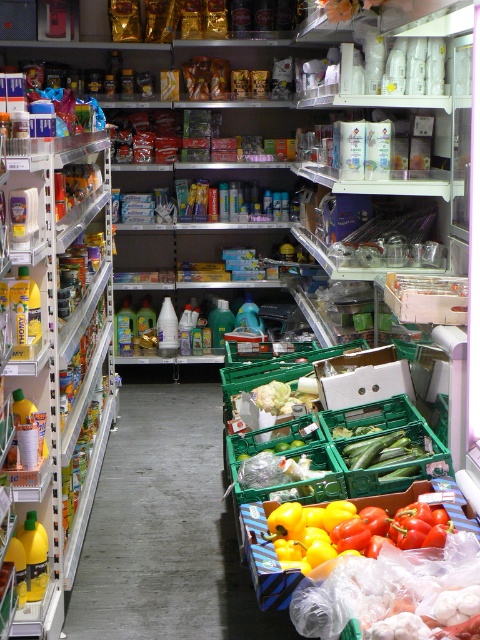
Is green plastic crate at center bigger than yellow matte bell pepper at center?

Yes, green plastic crate at center is bigger than yellow matte bell pepper at center.

Where is `green plastic crate at center`? The height and width of the screenshot is (640, 480). green plastic crate at center is located at coordinates (162, 528).

What do you see at coordinates (162, 528) in the screenshot? This screenshot has width=480, height=640. I see `green plastic crate at center` at bounding box center [162, 528].

The height and width of the screenshot is (640, 480). What are the coordinates of `green plastic crate at center` in the screenshot? It's located at (162, 528).